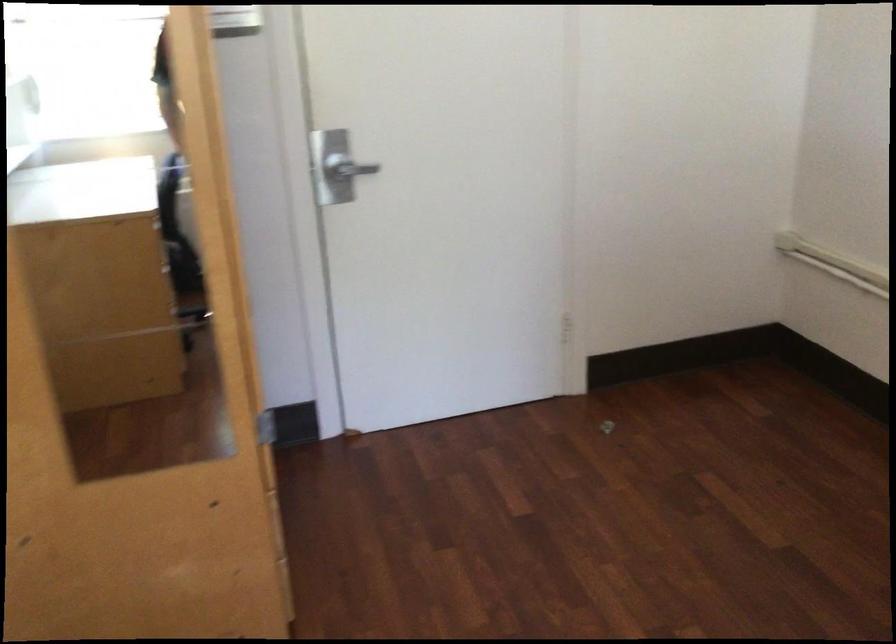
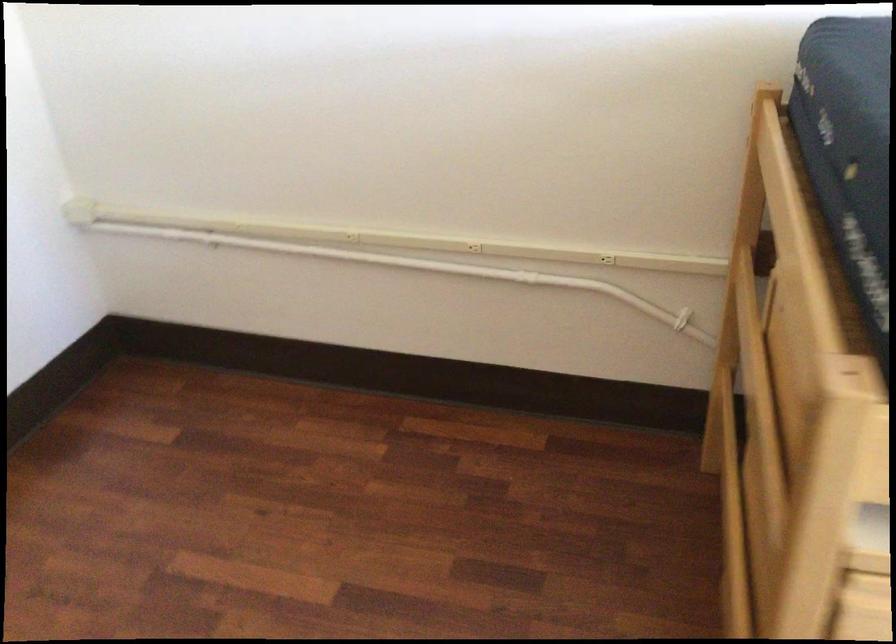
Question: The camera is either moving clockwise (left) or counter-clockwise (right) around the object. The first image is from the beginning of the video and the second image is from the end. Is the camera moving left or right when shooting the video?

Choices:
 (A) Left
 (B) Right

Answer: (A)